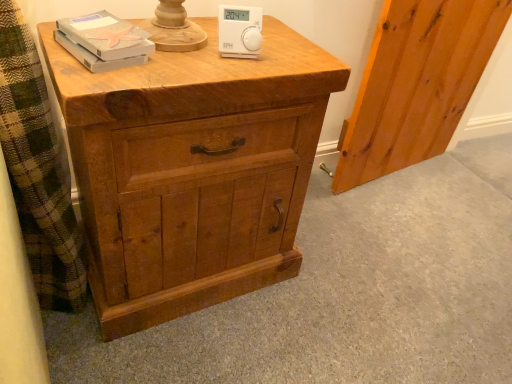
In order to click on free spot in front of white plastic thermostat at upper center in this screenshot , I will do `click(205, 66)`.